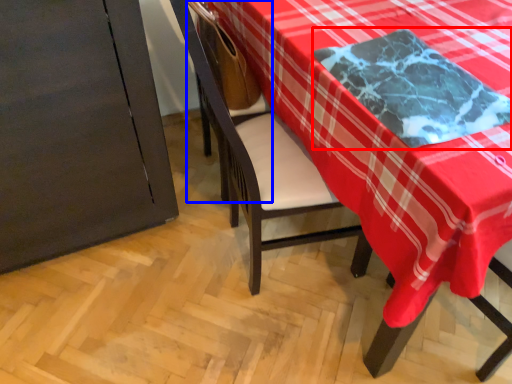
Question: Among these objects, which one is nearest to the camera, cloth (highlighted by a red box) or armchair (highlighted by a blue box)?

Choices:
 (A) cloth
 (B) armchair

Answer: (A)